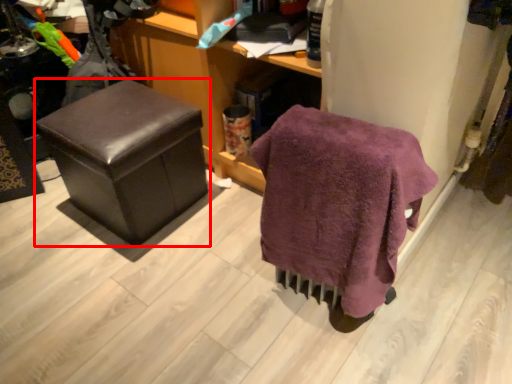
Question: From the image's perspective, where is furniture (annotated by the red box) located relative to bath towel?

Choices:
 (A) above
 (B) below

Answer: (A)